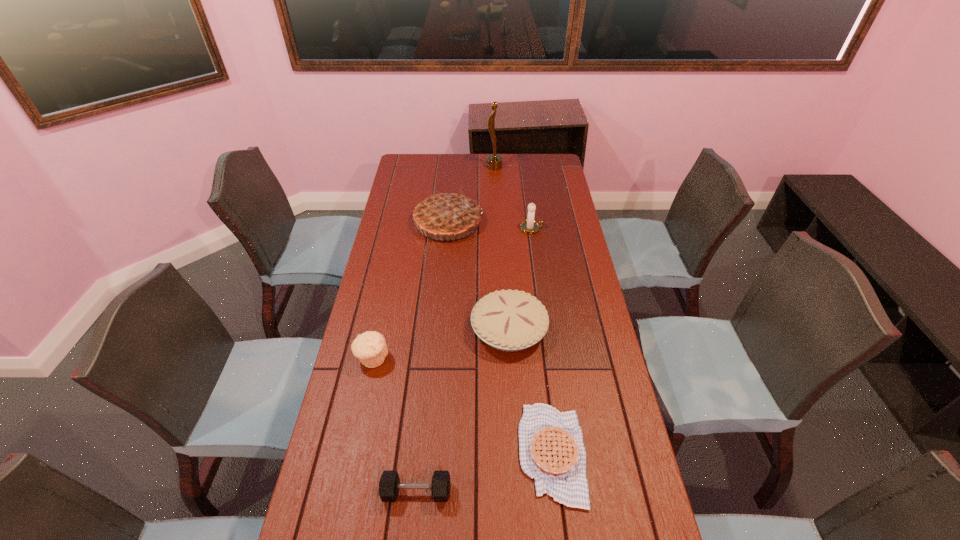
Where is `vacant space located 0.200m on the front-facing side of the award`? The width and height of the screenshot is (960, 540). vacant space located 0.200m on the front-facing side of the award is located at coordinates (446, 167).

Locate an element on the screen. Image resolution: width=960 pixels, height=540 pixels. free space located on the front-facing side of the award is located at coordinates (426, 167).

The image size is (960, 540). Identify the location of free location located 0.200m on the front-facing side of the award. (446, 167).

Where is `vacant region located 0.120m on the right of the farthest pie`? vacant region located 0.120m on the right of the farthest pie is located at coordinates (511, 221).

Where is `blank space located on the handle side of the fifth shortest object`? This screenshot has width=960, height=540. blank space located on the handle side of the fifth shortest object is located at coordinates (567, 228).

Locate an element on the screen. free space located 0.140m on the right of the leftmost object is located at coordinates (434, 358).

You are a GUI agent. You are given a task and a screenshot of the screen. Output one action in this format:
    pyautogui.click(x=<x>, y=<y>)
    Task: Click on the free region located 0.390m on the front of the second shortest pie
    This screenshot has height=540, width=960.
    Given the screenshot: What is the action you would take?
    pyautogui.click(x=519, y=492)

At what (x,y) coordinates should I click in order to perform the action: click on free region located 0.070m on the left of the second shortest object. Please return your answer as a coordinate pair (x, y). This screenshot has width=960, height=540. Looking at the image, I should click on (354, 492).

At what (x,y) coordinates should I click in order to perform the action: click on free space located on the left of the shortest pie. Please return your answer as a coordinate pair (x, y). This screenshot has height=540, width=960. Looking at the image, I should click on (377, 454).

You are a GUI agent. You are given a task and a screenshot of the screen. Output one action in this format:
    pyautogui.click(x=<x>, y=<y>)
    Task: Click on the object located in the far edge section of the desktop
    This screenshot has width=960, height=540.
    Given the screenshot: What is the action you would take?
    pyautogui.click(x=494, y=162)